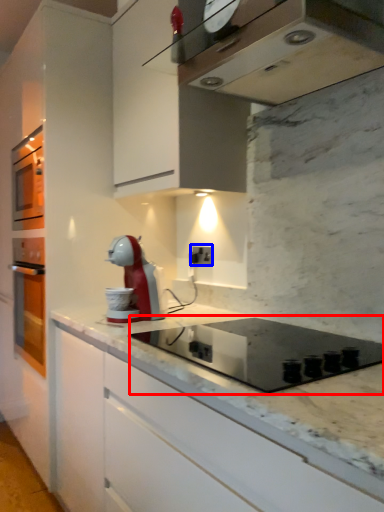
Question: Which point is further to the camera, appliance (highlighted by a red box) or electric outlet (highlighted by a blue box)?

Choices:
 (A) appliance
 (B) electric outlet

Answer: (B)